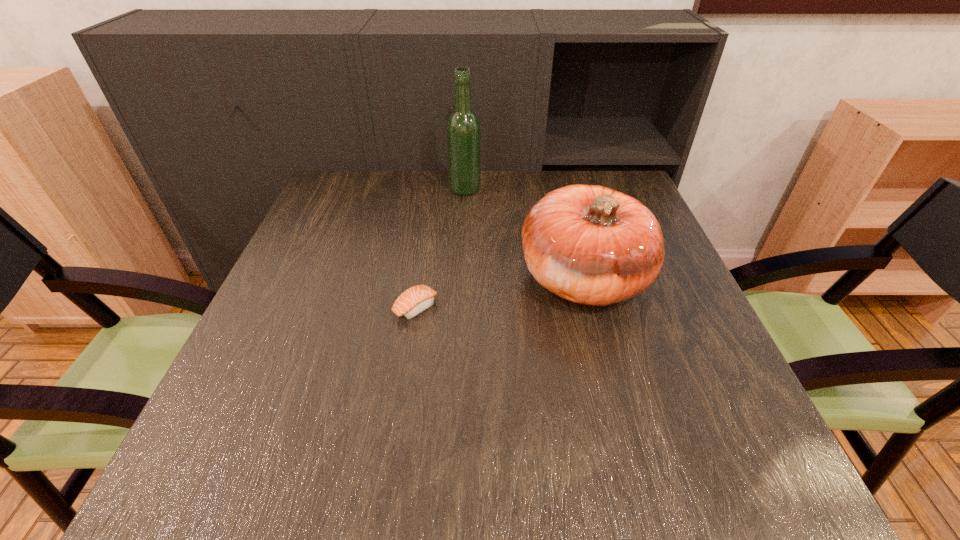
Locate an element on the screen. The width and height of the screenshot is (960, 540). the farthest object is located at coordinates (463, 127).

Locate an element on the screen. This screenshot has width=960, height=540. the second object from left to right is located at coordinates (463, 127).

This screenshot has width=960, height=540. I want to click on the rightmost object, so click(589, 244).

This screenshot has width=960, height=540. What are the coordinates of `pumpkin` in the screenshot? It's located at (589, 244).

Locate an element on the screen. This screenshot has height=540, width=960. the shortest object is located at coordinates (415, 300).

At what (x,y) coordinates should I click in order to perform the action: click on sushi. Please return your answer as a coordinate pair (x, y). This screenshot has height=540, width=960. Looking at the image, I should click on (415, 300).

Find the location of a particular element. The height and width of the screenshot is (540, 960). free region located on the front of the tallest object is located at coordinates (461, 278).

This screenshot has height=540, width=960. What are the coordinates of `free space located 0.270m on the left of the rightmost object` in the screenshot? It's located at (396, 278).

The height and width of the screenshot is (540, 960). Find the location of `vacant space situated 0.130m on the right of the sushi`. vacant space situated 0.130m on the right of the sushi is located at coordinates (500, 307).

The image size is (960, 540). In order to click on object positioned at the far edge in this screenshot , I will do `click(463, 127)`.